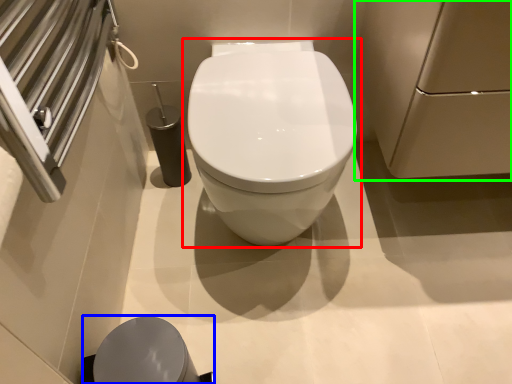
Question: Which object is the farthest from toilet (highlighted by a red box)? Choose among these: porcelain (highlighted by a blue box) or screen door (highlighted by a green box).

Choices:
 (A) porcelain
 (B) screen door

Answer: (A)